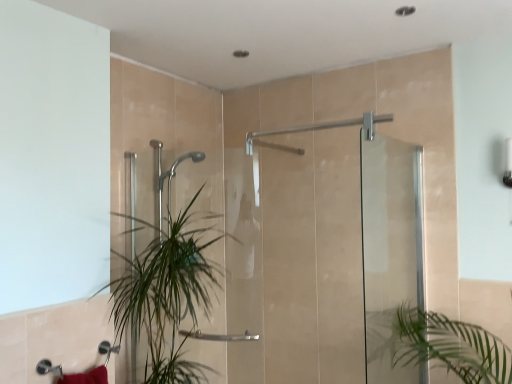
Question: Considering the relative sizes of transparent glass screen door at right, which is counted as the second screen door, starting from the left, and clear glass shower door at center, the first screen door when ordered from left to right, in the image provided, is transparent glass screen door at right, which is counted as the second screen door, starting from the left, thinner than clear glass shower door at center, the first screen door when ordered from left to right,?

Choices:
 (A) yes
 (B) no

Answer: (A)

Question: From a real-world perspective, is transparent glass screen door at right, which is counted as the second screen door, starting from the left, physically above clear glass shower door at center, the first screen door when ordered from left to right?

Choices:
 (A) yes
 (B) no

Answer: (B)

Question: Is transparent glass screen door at right, which is counted as the second screen door, starting from the left, next to clear glass shower door at center, the first screen door when ordered from left to right?

Choices:
 (A) no
 (B) yes

Answer: (B)

Question: Is transparent glass screen door at right, which is counted as the second screen door, starting from the left, not inside clear glass shower door at center, the first screen door when ordered from left to right?

Choices:
 (A) no
 (B) yes

Answer: (B)

Question: Does transparent glass screen door at right, the 1th screen door in the right-to-left sequence, lie in front of clear glass shower door at center, the first screen door when ordered from left to right?

Choices:
 (A) yes
 (B) no

Answer: (A)

Question: Considering the positions of point (377, 185) and point (419, 201), is point (377, 185) closer or farther from the camera than point (419, 201)?

Choices:
 (A) closer
 (B) farther

Answer: (B)

Question: In terms of height, does transparent glass screen door at right, which is counted as the second screen door, starting from the left, look taller or shorter compared to clear glass shower door at center, the first screen door when ordered from left to right?

Choices:
 (A) short
 (B) tall

Answer: (B)

Question: In terms of size, does transparent glass screen door at right, which is counted as the second screen door, starting from the left, appear bigger or smaller than clear glass shower door at center, which ranks as the second screen door in right-to-left order?

Choices:
 (A) small
 (B) big

Answer: (A)

Question: Considering the relative positions of transparent glass screen door at right, which is counted as the second screen door, starting from the left, and clear glass shower door at center, which ranks as the second screen door in right-to-left order, in the image provided, is transparent glass screen door at right, which is counted as the second screen door, starting from the left, to the left or to the right of clear glass shower door at center, which ranks as the second screen door in right-to-left order,?

Choices:
 (A) left
 (B) right

Answer: (B)

Question: In terms of width, does clear glass shower door at center, the first screen door when ordered from left to right, look wider or thinner when compared to green leafy plant at center?

Choices:
 (A) thin
 (B) wide

Answer: (A)

Question: From a real-world perspective, is clear glass shower door at center, the first screen door when ordered from left to right, above or below green leafy plant at center?

Choices:
 (A) below
 (B) above

Answer: (B)

Question: In the image, is clear glass shower door at center, which ranks as the second screen door in right-to-left order, on the left side or the right side of green leafy plant at center?

Choices:
 (A) right
 (B) left

Answer: (A)

Question: From the image's perspective, is clear glass shower door at center, which ranks as the second screen door in right-to-left order, above or below green leafy plant at center?

Choices:
 (A) below
 (B) above

Answer: (B)

Question: Which is correct: transparent glass screen door at right, which is counted as the second screen door, starting from the left, is inside green leafy plant at center, or outside of it?

Choices:
 (A) inside
 (B) outside

Answer: (B)

Question: Based on their sizes in the image, would you say transparent glass screen door at right, the 1th screen door in the right-to-left sequence, is bigger or smaller than green leafy plant at center?

Choices:
 (A) big
 (B) small

Answer: (B)